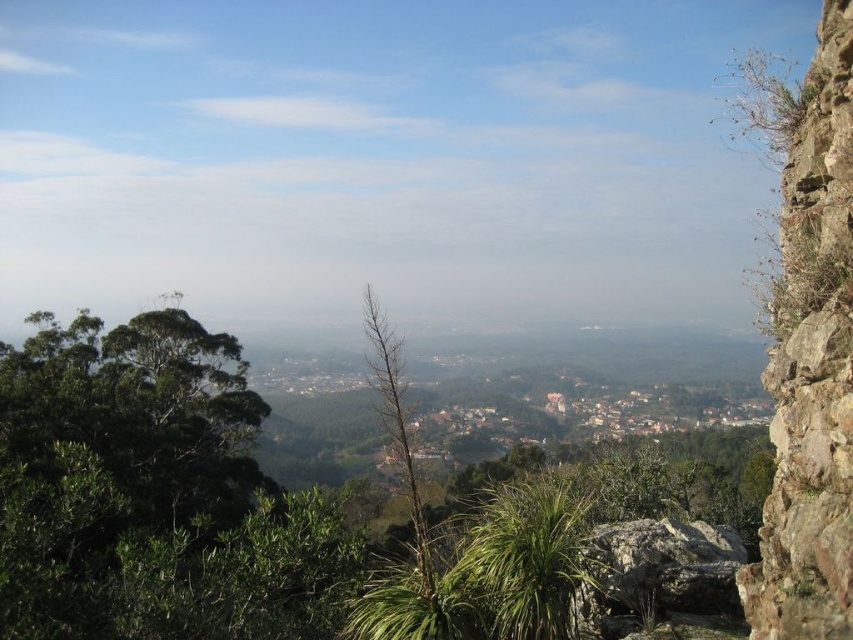
Between point (830, 468) and point (717, 577), which one is positioned in front?

Point (830, 468)

Looking at this image, is rusty stone cliff at right to the left of rough textured rock at center from the viewer's perspective?

No, rusty stone cliff at right is not to the left of rough textured rock at center.

At what (x,y) coordinates should I click in order to perform the action: click on rusty stone cliff at right. Please return your answer as a coordinate pair (x, y). This screenshot has height=640, width=853. Looking at the image, I should click on (811, 368).